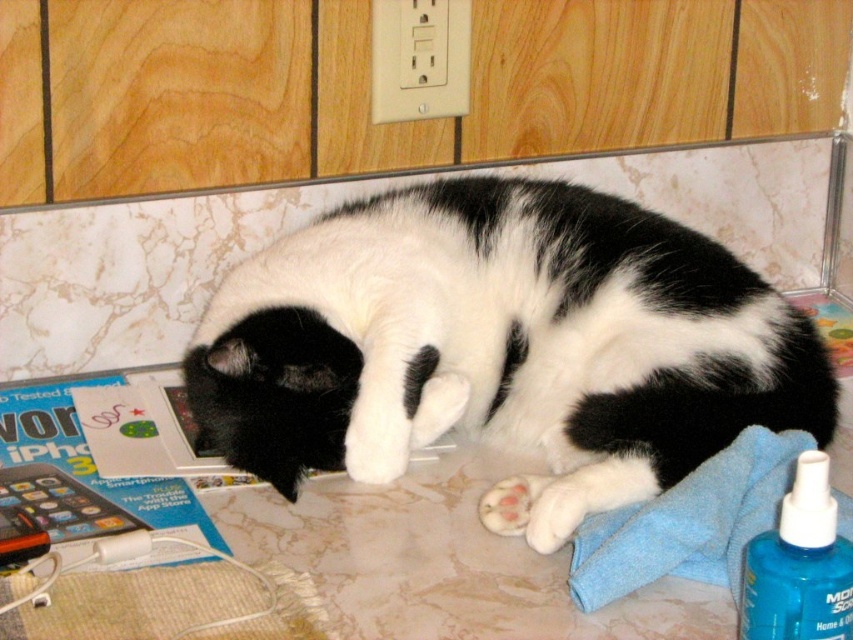
Measure the distance between black and white fur cat at center and white soft paw at lower center.

The distance of black and white fur cat at center from white soft paw at lower center is 10.24 inches.

Is point (782, 372) behind point (570, 481)?

Yes, it is behind point (570, 481).

Find the location of `black and white fur cat at center`. black and white fur cat at center is located at coordinates (500, 340).

Is blue plastic spray bottle at lower right wider than white fluffy paw at lower center?

Yes, blue plastic spray bottle at lower right is wider than white fluffy paw at lower center.

Which of these two, blue plastic spray bottle at lower right or white fluffy paw at lower center, stands shorter?

With less height is white fluffy paw at lower center.

Who is more forward, [781,509] or [506,484]?

Point [781,509] is in front.

The width and height of the screenshot is (853, 640). Identify the location of blue plastic spray bottle at lower right. (799, 564).

Who is more forward, (659, 321) or (490, 518)?

Point (490, 518) is in front.

The width and height of the screenshot is (853, 640). In order to click on black and white fur cat at center in this screenshot , I will do `click(500, 340)`.